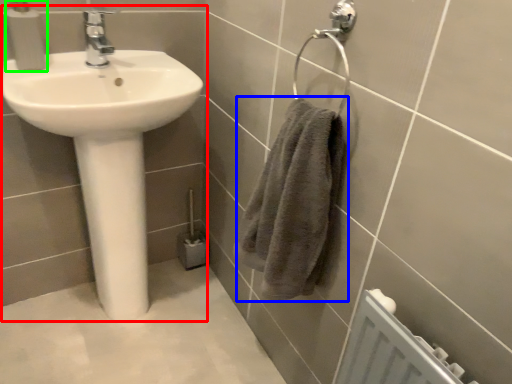
Question: Which object is the closest to the sink (highlighted by a red box)? Choose among these: bath towel (highlighted by a blue box) or soap dispenser (highlighted by a green box).

Choices:
 (A) bath towel
 (B) soap dispenser

Answer: (B)